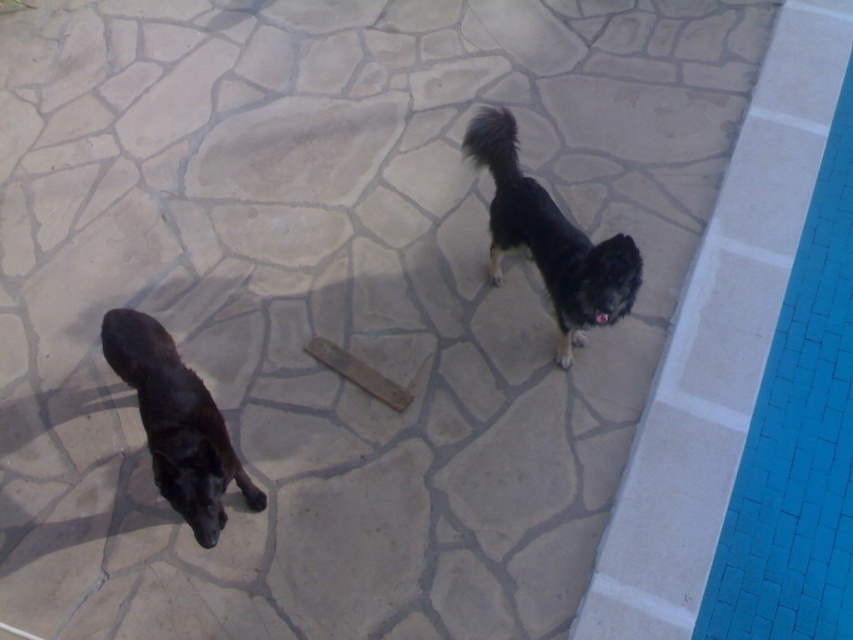
You are a photographer trying to capture both dogs in a single frame. Since the black fur dog at upper right and the black matte dog at lower left are positioned close to each other, which dog is more to the right side?

The black fur dog at upper right is positioned on the right side of black matte dog at lower left, so the black fur dog at upper right is more to the right side.

You are standing at the point marked as point (167, 445) near the pool edge. You want to throw a ball to your friend who is standing 5 feet away from you. Is your friend within the 6.76 feet distance limit?

The distance between you and the viewer at point (167, 445) is 6.76 feet. Since your friend is 5 feet away from you, they are within the 6.76 feet distance limit.